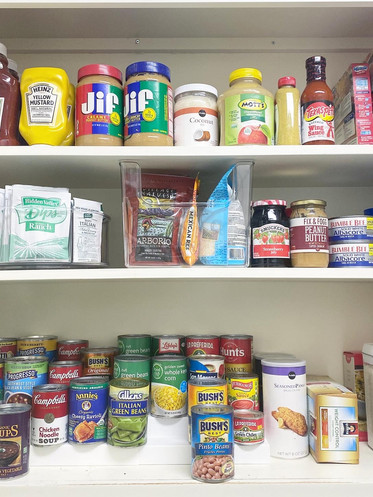
Where is `jar`? Image resolution: width=373 pixels, height=497 pixels. jar is located at coordinates (104, 119), (150, 123), (204, 128), (244, 127), (264, 237), (313, 244).